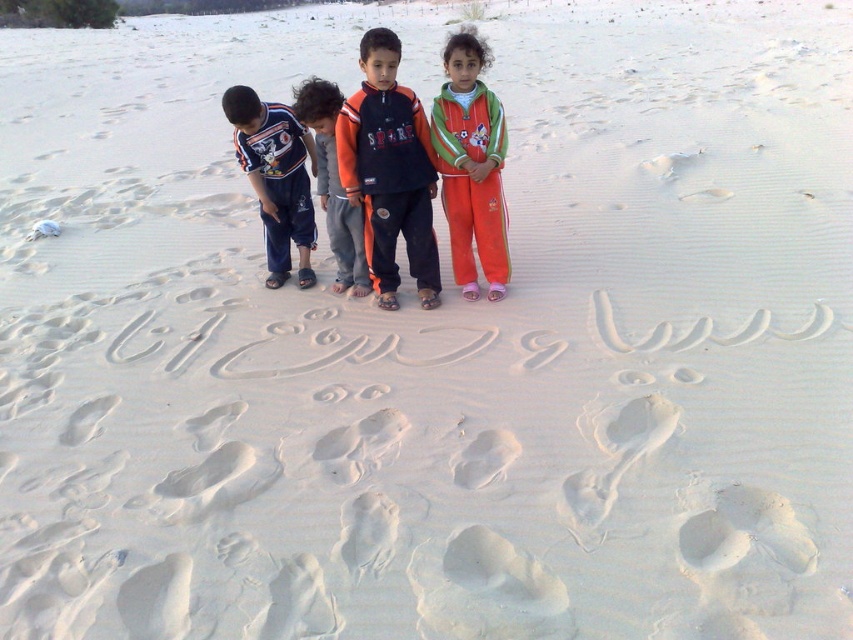
Between orange cotton shirt at center and orange fleece tracksuit at center, which one is positioned higher?

Positioned higher is orange fleece tracksuit at center.

Does point (396, 276) come farther from viewer compared to point (434, 122)?

Yes, point (396, 276) is farther from viewer.

What do you see at coordinates (389, 172) in the screenshot?
I see `orange cotton shirt at center` at bounding box center [389, 172].

I want to click on orange cotton shirt at center, so point(389,172).

Is orange cotton pants at left to the left of orange fleece jacket at center from the viewer's perspective?

Indeed, orange cotton pants at left is positioned on the left side of orange fleece jacket at center.

Measure the distance between orange cotton pants at left and orange fleece jacket at center.

29.01 centimeters

Does point (314, 161) lie in front of point (352, 268)?

No.

Where is `orange cotton pants at left`? This screenshot has height=640, width=853. orange cotton pants at left is located at coordinates (276, 179).

Between orange fleece tracksuit at center and orange cotton pants at left, which one appears on the right side from the viewer's perspective?

From the viewer's perspective, orange fleece tracksuit at center appears more on the right side.

Between orange fleece tracksuit at center and orange cotton pants at left, which one is positioned lower?

orange cotton pants at left is lower down.

Between point (451, 42) and point (241, 109), which one is positioned in front?

Point (451, 42) is in front.

I want to click on orange fleece tracksuit at center, so click(471, 164).